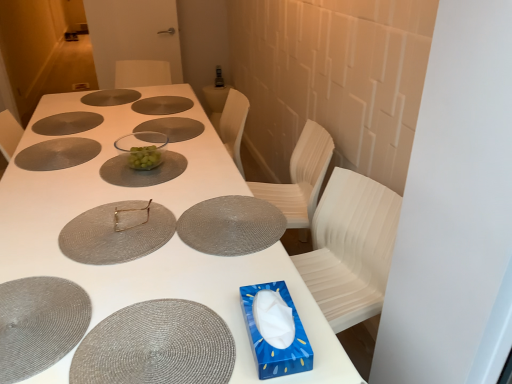
Where is `free region under matte gray glass plate at upper center, which ranks as the 1th glass plate in back-to-front order (from a real-world perspective)`? The height and width of the screenshot is (384, 512). free region under matte gray glass plate at upper center, which ranks as the 1th glass plate in back-to-front order (from a real-world perspective) is located at coordinates (103, 94).